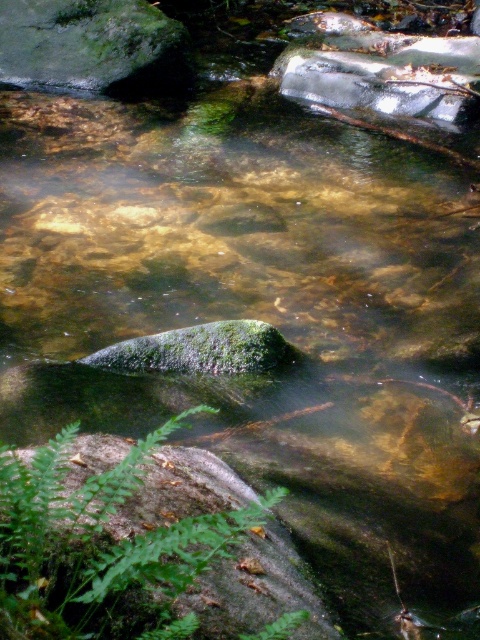
Question: Can you confirm if green fuzzy fern at lower left is positioned above green mossy rock at upper left?

Choices:
 (A) no
 (B) yes

Answer: (A)

Question: Which object appears closest to the camera in this image?

Choices:
 (A) green mossy rock at upper left
 (B) green fuzzy fern at lower left

Answer: (B)

Question: Is green fuzzy fern at lower left to the left of green mossy rock at upper left from the viewer's perspective?

Choices:
 (A) yes
 (B) no

Answer: (B)

Question: From the image, what is the correct spatial relationship of green fuzzy fern at lower left in relation to green mossy rock at upper left?

Choices:
 (A) above
 (B) below

Answer: (B)

Question: Among these points, which one is farthest from the camera?

Choices:
 (A) (96, 534)
 (B) (33, 44)

Answer: (B)